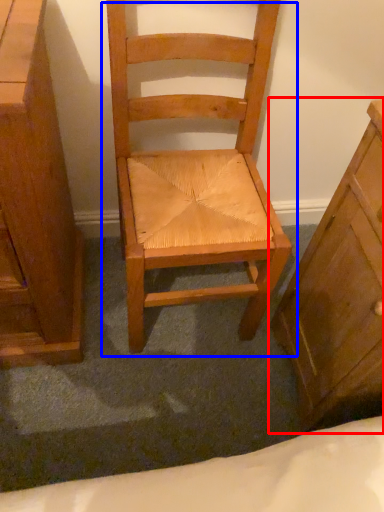
Question: Which object appears farthest to the camera in this image, chest of drawers (highlighted by a red box) or chair (highlighted by a blue box)?

Choices:
 (A) chest of drawers
 (B) chair

Answer: (B)